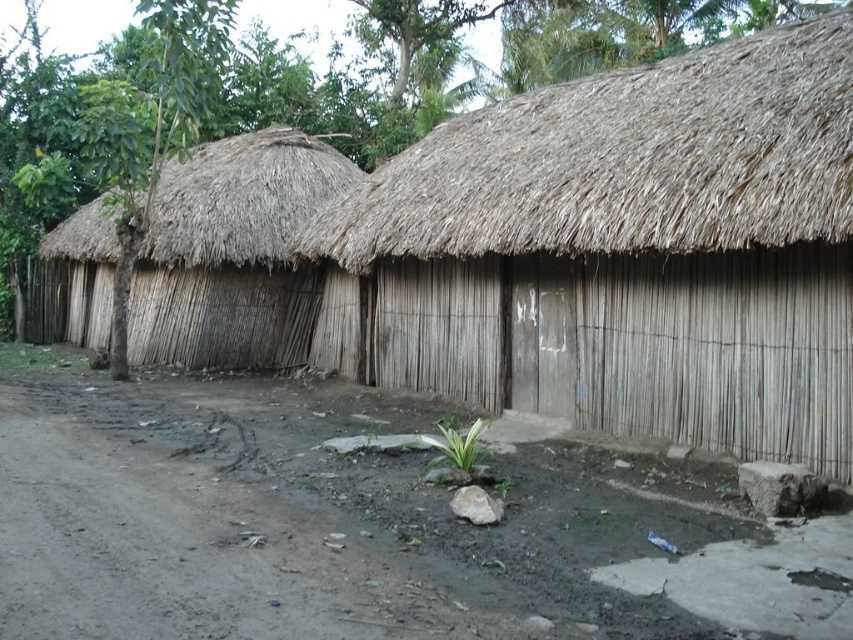
You are a traveler approaching the huts and want to reach the brown thatch roof at upper center. Which direction should you go from the brown dirt track at lower left?

The brown dirt track at lower left is in front of the brown thatch roof at upper center, so you should go towards the direction of the brown thatch roof at upper center from the brown dirt track at lower left.

You are standing in front of the row of thatched huts and notice two points marked in the dirt ground. Which point, point [717,152] or point [235,288], is closer to you?

Point [717,152] is closer to the viewer than point [235,288].